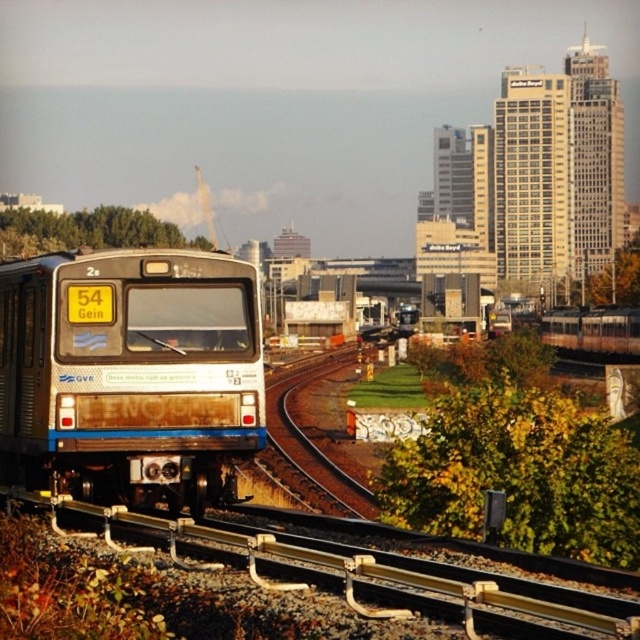
Consider the image. You are a pedestrian standing on the sidewalk next to the railway tracks. You see the rusty metal train at center and the brown metal rail at center. Which object is closer to your left side?

The rusty metal train at center is positioned on the left side of brown metal rail at center, so from your perspective as a pedestrian on the sidewalk, the rusty metal train at center would be closer to your left side.

You are standing at the origin point of the coordinate system in the image. Which object is located at the coordinates point [129,374]?

The rusty metal train at center is located at point [129,374].